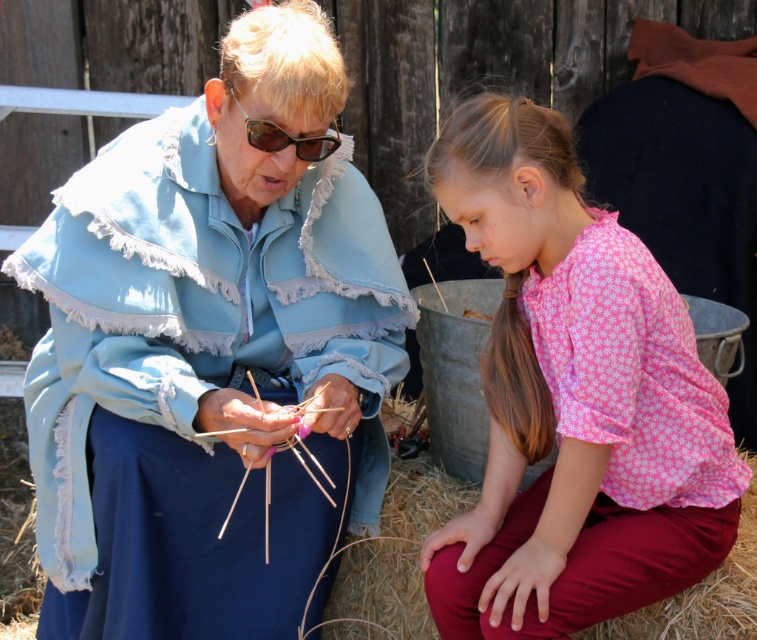
Based on the scene description, which object is taller between the light blue fabric at center and the matte black goggles at upper center?

The light blue fabric at center is taller than the matte black goggles at upper center.